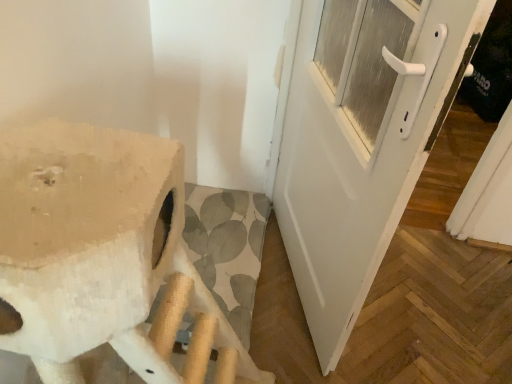
Locate an element on the screen. Image resolution: width=512 pixels, height=384 pixels. vacant area located to the right-hand side of white matte door at center is located at coordinates (434, 306).